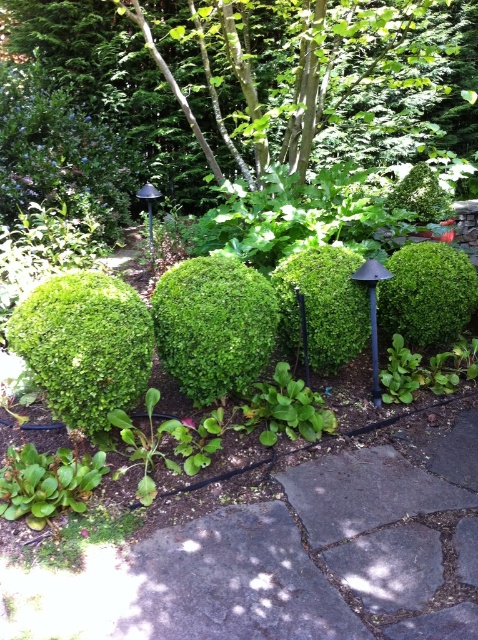
Looking at this image, can you confirm if green matte shrub at center is taller than green leafy shrub at upper center?

Yes, green matte shrub at center is taller than green leafy shrub at upper center.

Which of these two, green matte shrub at center or green leafy shrub at upper center, stands shorter?

Standing shorter between the two is green leafy shrub at upper center.

Is point (174, 349) closer to viewer compared to point (437, 193)?

Yes, it is in front of point (437, 193).

The height and width of the screenshot is (640, 478). Identify the location of green matte shrub at center. (214, 324).

Where is `green fuzzy bush at left`? The height and width of the screenshot is (640, 478). green fuzzy bush at left is located at coordinates (85, 346).

The height and width of the screenshot is (640, 478). I want to click on green fuzzy bush at left, so click(85, 346).

Can you confirm if green matte shrub at center is positioned to the left of green mossy bush at center?

Yes, green matte shrub at center is to the left of green mossy bush at center.

Does green matte shrub at center appear under green mossy bush at center?

Correct, green matte shrub at center is located below green mossy bush at center.

Locate an element on the screen. The image size is (478, 640). green matte shrub at center is located at coordinates (214, 324).

This screenshot has height=640, width=478. I want to click on green matte shrub at center, so click(x=214, y=324).